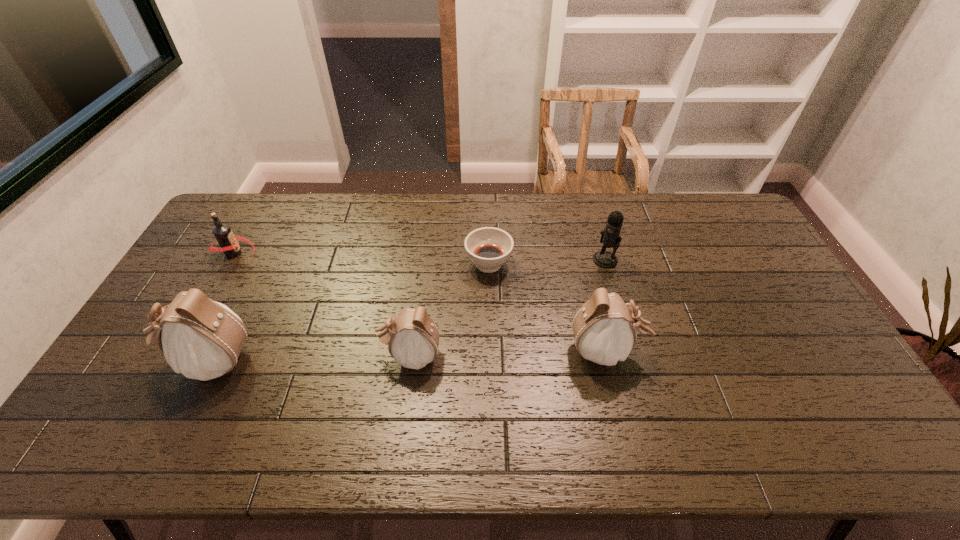
I want to click on free location that satisfies the following two spatial constraints: 1. on the label of the root beer; 2. on the left side of the soup bowl, so (228, 264).

The image size is (960, 540). Find the location of `vacant space that satisfies the following two spatial constraints: 1. on the front side of the soup bowl; 2. on the front-facing side of the leftmost pouch`. vacant space that satisfies the following two spatial constraints: 1. on the front side of the soup bowl; 2. on the front-facing side of the leftmost pouch is located at coordinates (491, 361).

Where is `vacant space that satisfies the following two spatial constraints: 1. on the back side of the microphone; 2. on the label of the root beer`? The image size is (960, 540). vacant space that satisfies the following two spatial constraints: 1. on the back side of the microphone; 2. on the label of the root beer is located at coordinates (603, 253).

Find the location of a particular element. Image resolution: width=960 pixels, height=540 pixels. vacant position in the image that satisfies the following two spatial constraints: 1. on the label of the shortest object; 2. on the right side of the root beer is located at coordinates (228, 264).

Find the location of a particular element. This screenshot has width=960, height=540. vacant space that satisfies the following two spatial constraints: 1. on the back side of the microphone; 2. on the right side of the shortest object is located at coordinates (489, 259).